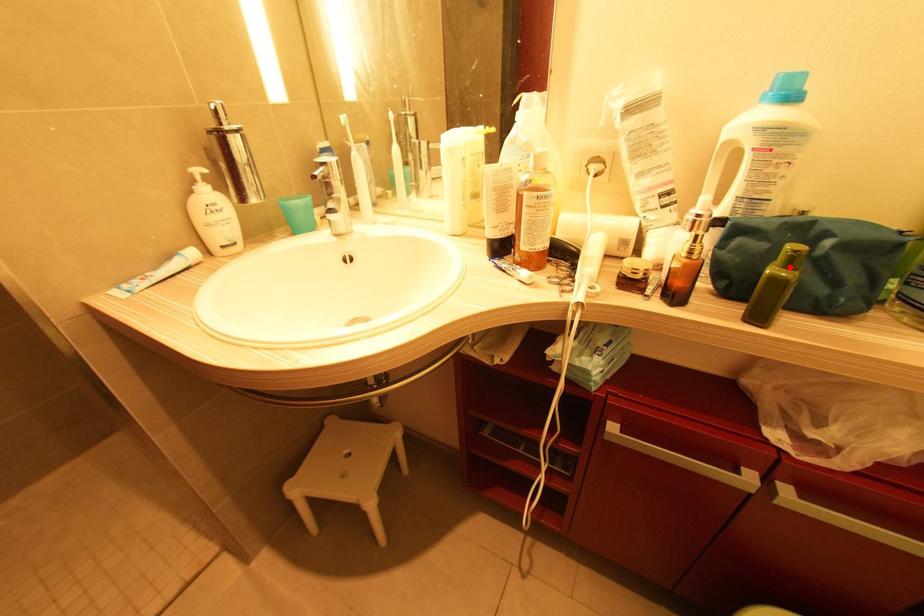
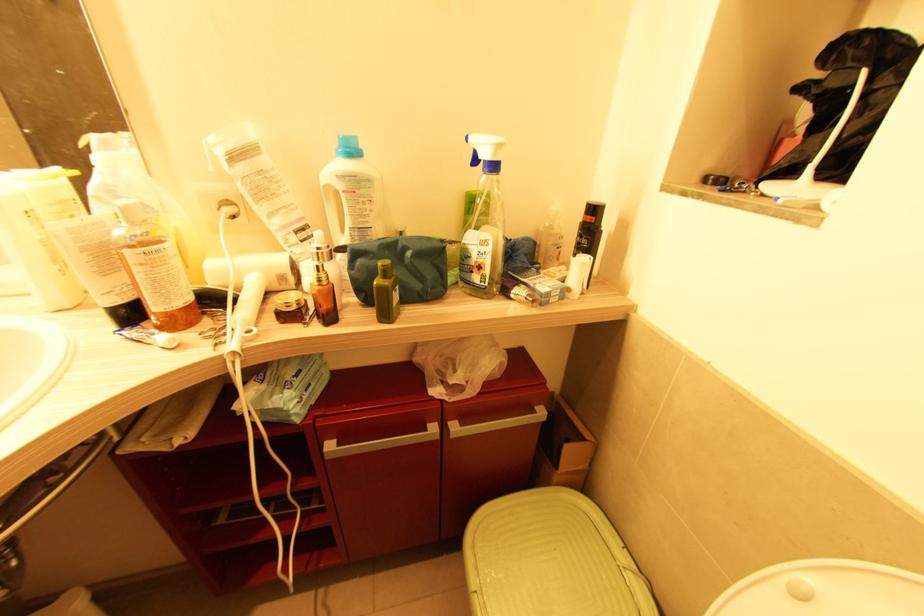
The point at the highlighted location is marked in the first image. Where is the corresponding point in the second image?

(386, 278)